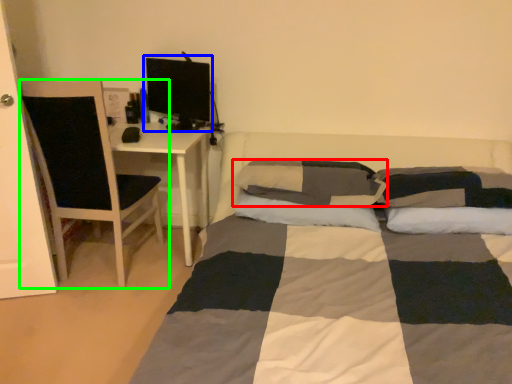
Question: Which object is positioned closest to pillow (highlighted by a red box)? Select from computer monitor (highlighted by a blue box) and chair (highlighted by a green box).

Choices:
 (A) computer monitor
 (B) chair

Answer: (A)